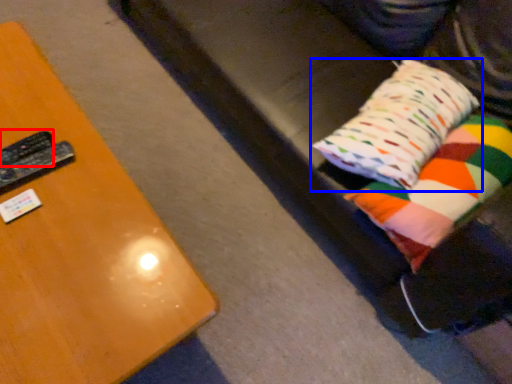
Question: Which of the following is the closest to the observer, remote (highlighted by a red box) or pillow (highlighted by a blue box)?

Choices:
 (A) remote
 (B) pillow

Answer: (B)